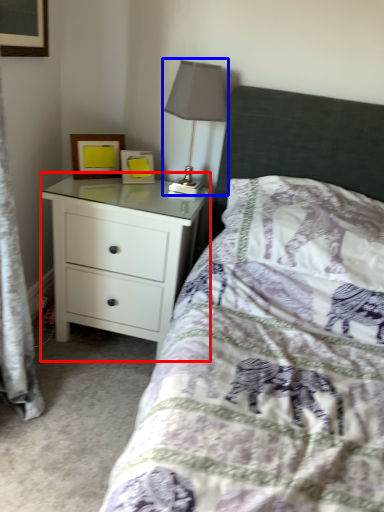
Question: Which object appears closest to the camera in this image, chest of drawers (highlighted by a red box) or table lamp (highlighted by a blue box)?

Choices:
 (A) chest of drawers
 (B) table lamp

Answer: (B)